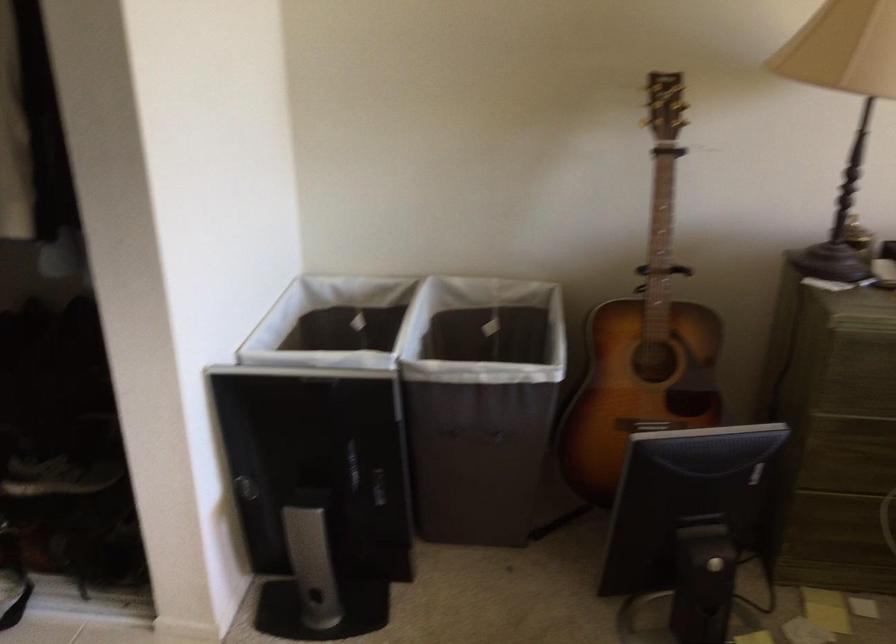
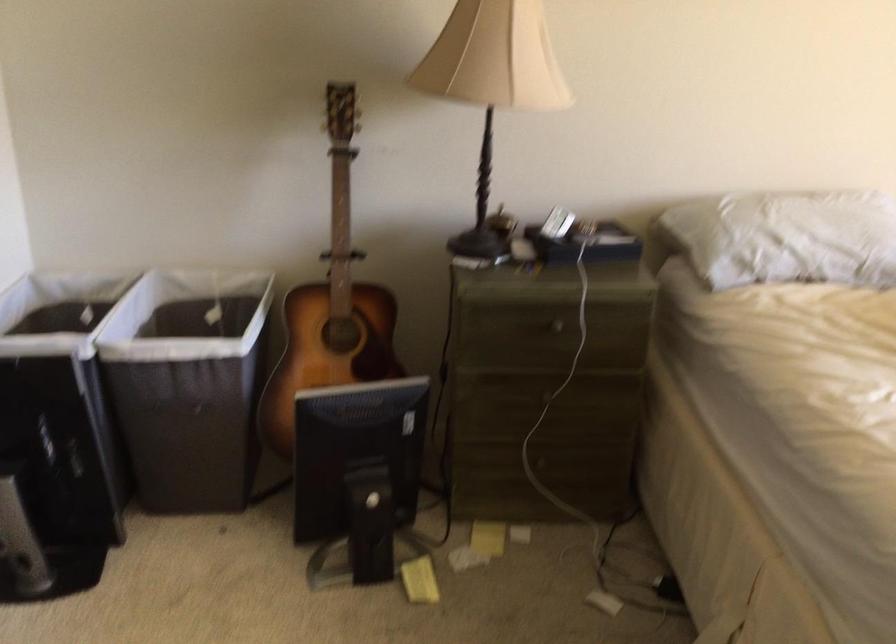
Locate, in the second image, the point that corresponds to (x=484, y=412) in the first image.

(188, 384)